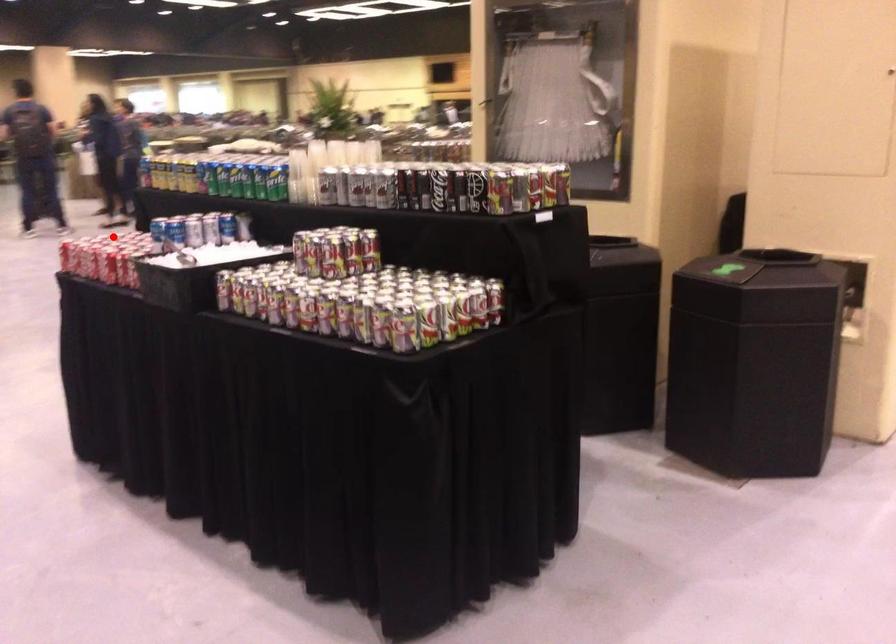
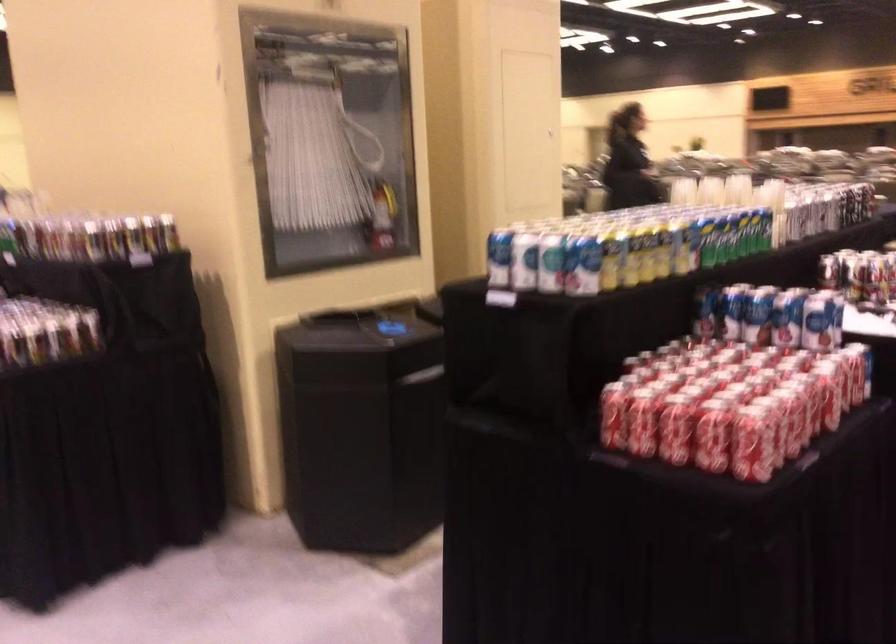
Question: I am providing you with two images of the same scene from different viewpoints. A red point is marked on the first image. At the location where the point appears in image 1, is it still visible in image 2?

Choices:
 (A) Yes
 (B) No

Answer: (A)